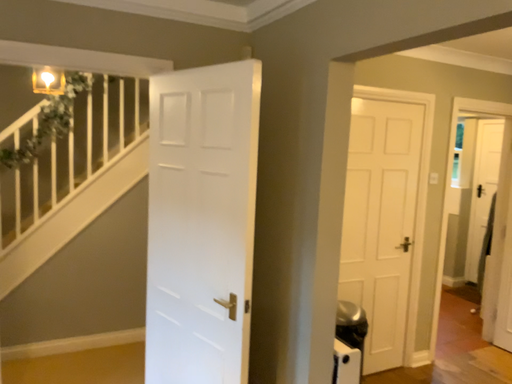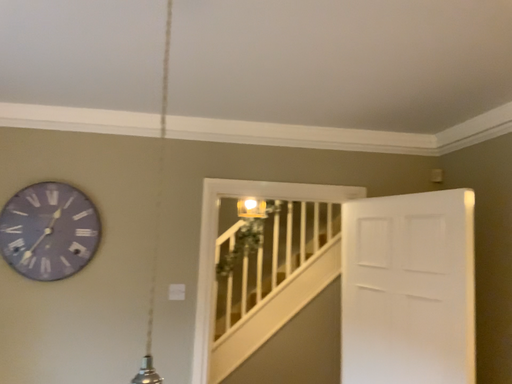
Question: Which way did the camera rotate in the video?

Choices:
 (A) rotated right
 (B) rotated left

Answer: (B)